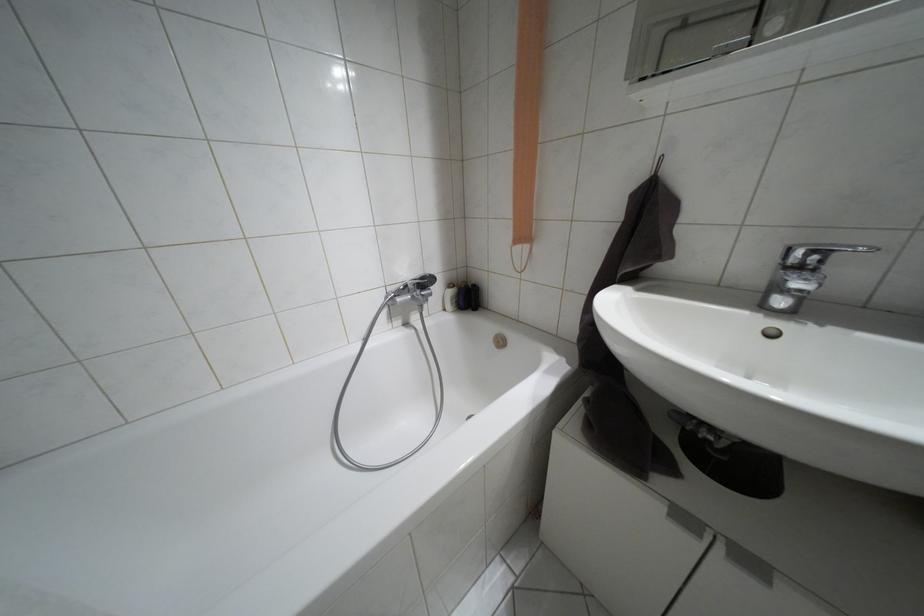
What do you see at coordinates (821, 251) in the screenshot? I see `the faucet handle` at bounding box center [821, 251].